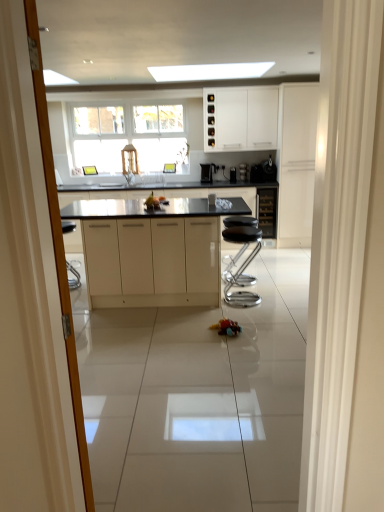
Question: Does point (283, 150) appear closer or farther from the camera than point (276, 112)?

Choices:
 (A) farther
 (B) closer

Answer: (B)

Question: Considering the positions of white matte cabinet at right, the first cabinetry viewed from the right, and white matte cabinet at upper center, arranged as the first cabinetry when viewed from the left, in the image, is white matte cabinet at right, the first cabinetry viewed from the right, wider or thinner than white matte cabinet at upper center, arranged as the first cabinetry when viewed from the left,?

Choices:
 (A) thin
 (B) wide

Answer: (B)

Question: Which object is positioned farthest from the satin black coffee maker at center, the second appliance from the right?

Choices:
 (A) rubberized plastic toy car at center
 (B) matte black cabinet at center, placed as the second cabinetry when sorted from left to right
 (C) black granite countertop at center
 (D) satin black coffee machine at center, the second coffee machine in the left-to-right sequence
 (E) satin black coffee machine at upper right, the third appliance positioned from the left

Answer: (A)

Question: Based on their relative distances, which object is farther from the black leather stool at center?

Choices:
 (A) rubberized plastic toy car at center
 (B) black granite countertop at center
 (C) satin black coffee machine at center, the 2th coffee machine positioned from the right
 (D) satin black coffee machine at center, the second coffee machine in the left-to-right sequence
 (E) satin black coffee maker at center, placed as the second appliance when sorted from left to right

Answer: (C)